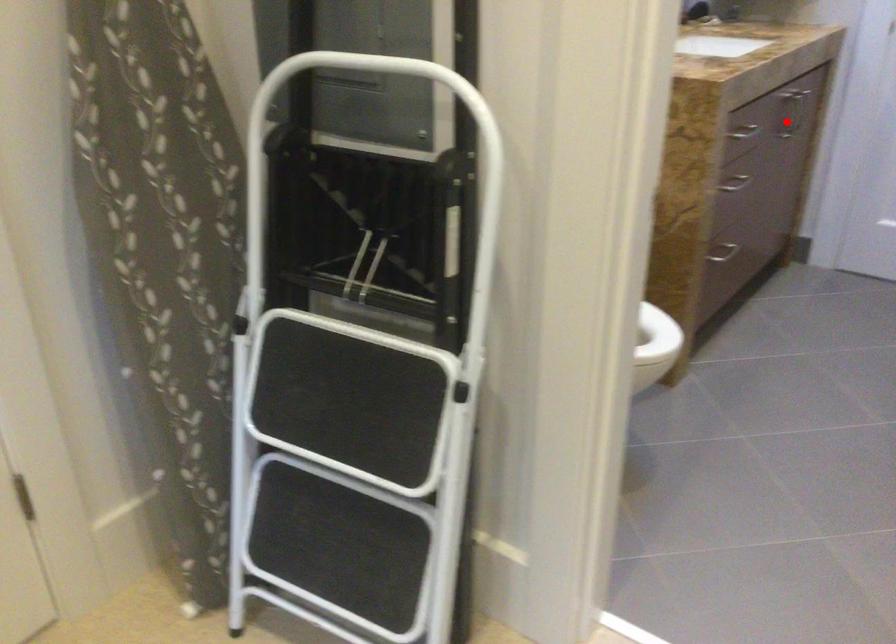
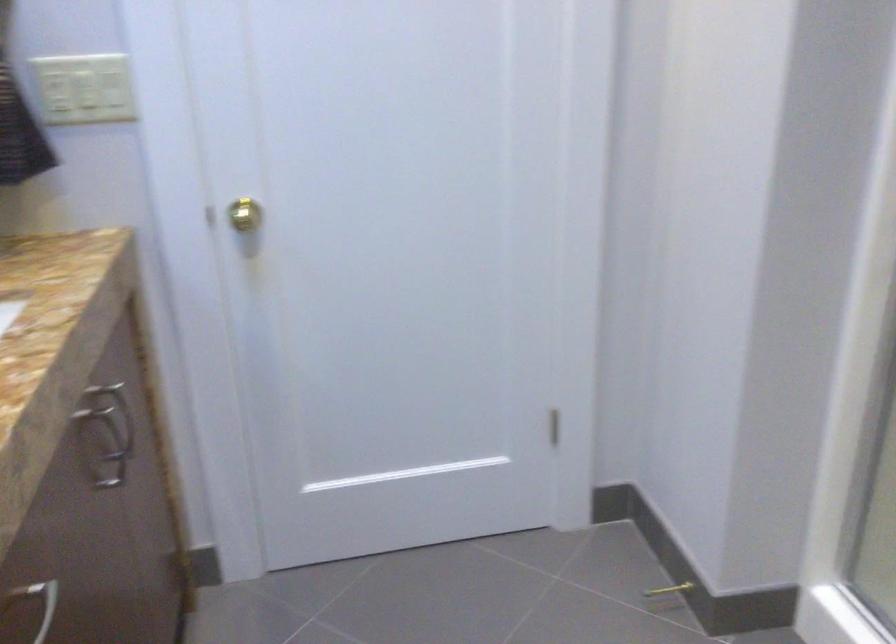
Question: I am providing you with two images of the same scene from different viewpoints. A red point is marked on the first image. Can you still see the location of the red point in image 2?

Choices:
 (A) Yes
 (B) No

Answer: (A)